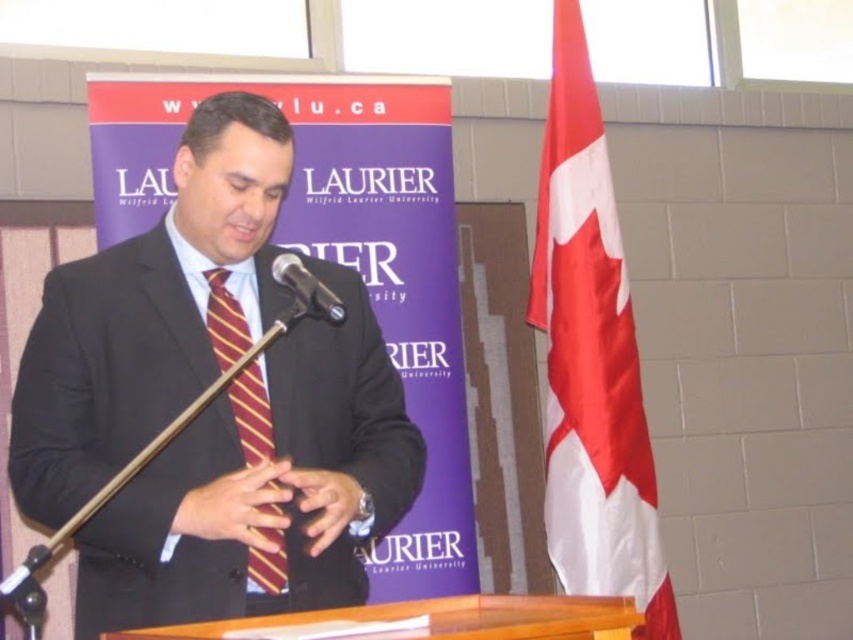
Image resolution: width=853 pixels, height=640 pixels. Identify the location of maroon striped tie at center. (251, 413).

Which is behind, point (236, 426) or point (287, 312)?

The point (236, 426) is behind.

At what (x,y) coordinates should I click in order to perform the action: click on maroon striped tie at center. Please return your answer as a coordinate pair (x, y). Looking at the image, I should click on (251, 413).

Is silky fabric flag at right to the left of black metallic microphone at center from the viewer's perspective?

No, silky fabric flag at right is not to the left of black metallic microphone at center.

Is silky fabric flag at right wider than black metallic microphone at center?

Yes, silky fabric flag at right is wider than black metallic microphone at center.

Who is more distant from viewer, (639,524) or (328,308)?

The point (639,524) is behind.

Locate an element on the screen. The image size is (853, 640). silky fabric flag at right is located at coordinates (590, 356).

Can you confirm if silky fabric flag at right is wider than maroon striped tie at center?

Yes, silky fabric flag at right is wider than maroon striped tie at center.

Which of these two, silky fabric flag at right or maroon striped tie at center, stands shorter?

With less height is maroon striped tie at center.

Does point (675, 616) lie in front of point (241, 422)?

No, it is behind (241, 422).

This screenshot has height=640, width=853. Identify the location of silky fabric flag at right. (590, 356).